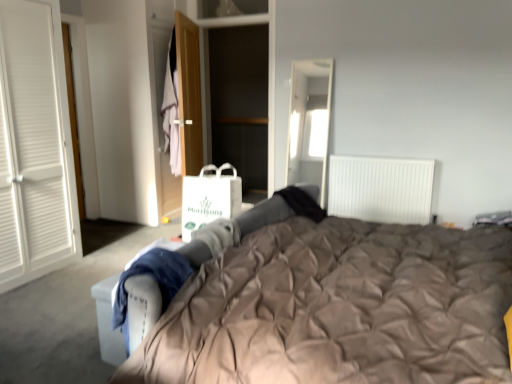
The image size is (512, 384). In order to click on vacant space situated above dark wood cabinet at center (from a real-world perspective) in this screenshot , I will do [229, 19].